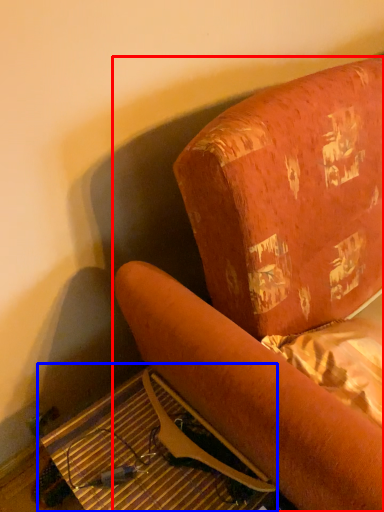
Question: Which of the following is the closest to the observer, furniture (highlighted by a red box) or table (highlighted by a blue box)?

Choices:
 (A) furniture
 (B) table

Answer: (A)